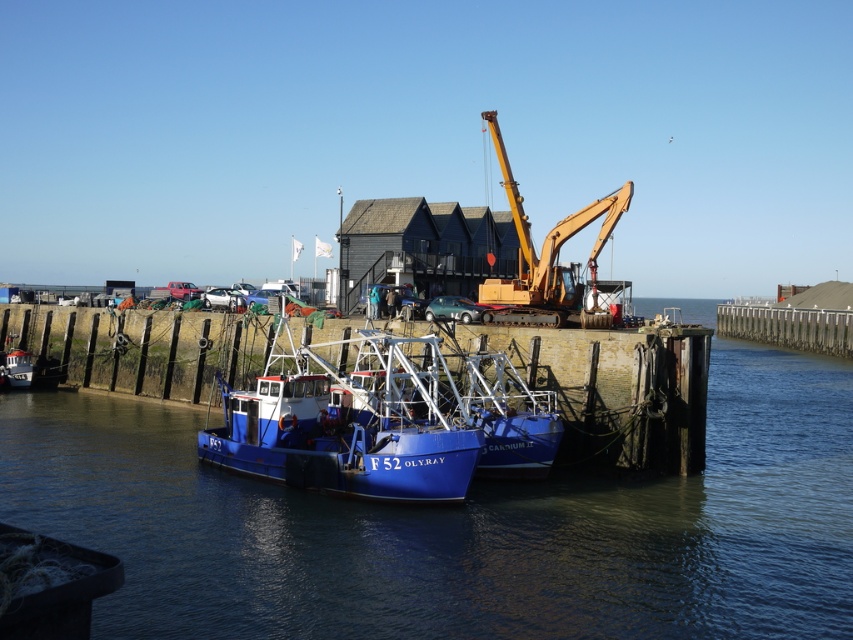
Does blue water at center appear over blue matte boat at center?

No, blue water at center is not above blue matte boat at center.

Is blue water at center bigger than blue matte boat at center?

Indeed, blue water at center has a larger size compared to blue matte boat at center.

Describe the element at coordinates (462, 528) in the screenshot. This screenshot has width=853, height=640. I see `blue water at center` at that location.

Locate an element on the screen. The height and width of the screenshot is (640, 853). blue water at center is located at coordinates (462, 528).